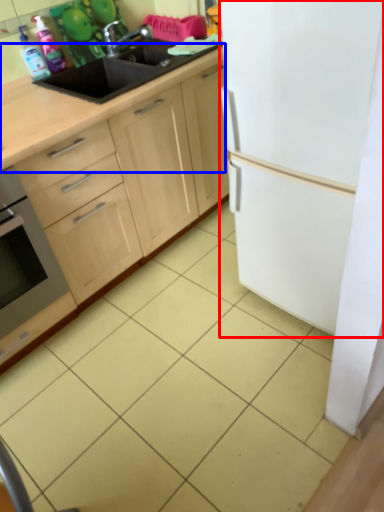
Question: Which object is closer to the camera taking this photo, refrigerator (highlighted by a red box) or countertop (highlighted by a blue box)?

Choices:
 (A) refrigerator
 (B) countertop

Answer: (A)